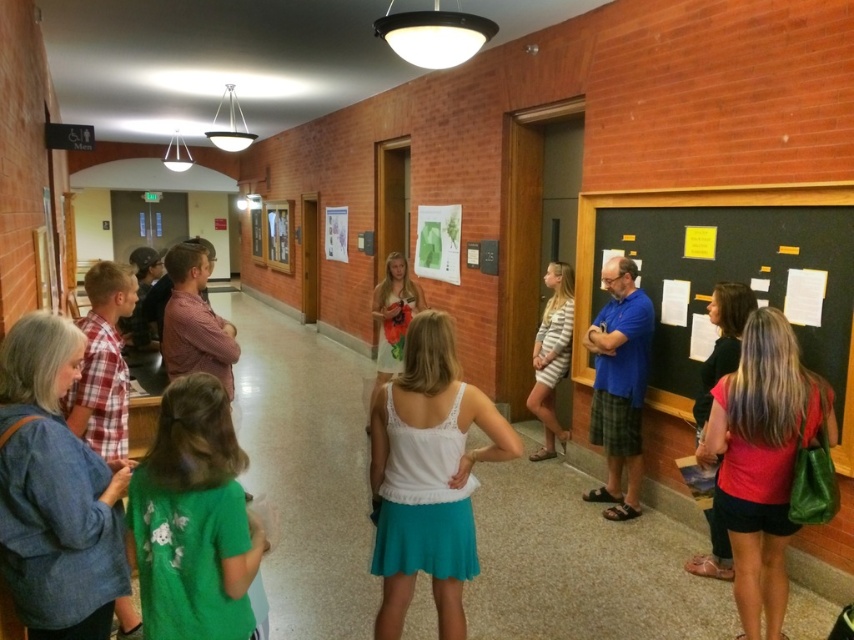
Please provide the exact coordinates of the white lace tank top at center in the image. The coordinates should be in the format of a point with two decimal places, such as point 0.5,0.5.

The white lace tank top at center is located at point (428, 476).

You are standing in the hallway and want to read the papers pinned to the chalkboard on the right. You are currently wearing the white lace tank top at center. If you take three steps forward, will you be close enough to read the papers?

The distance between you and the chalkboard is 2.29 meters. Taking three steps forward reduces the distance, but unless each step covers more than 0.76 meters, you might still be too far to read the papers clearly.

You are a photographer taking a picture of the scene. You notice the white lace tank top at center and the matte red shirt at right. Which clothing item should you focus on first if you want to capture them both in the frame without moving the camera?

The white lace tank top at center is to the left of the matte red shirt at right, so you should focus on the white lace tank top at center first to ensure both are in frame without moving the camera.